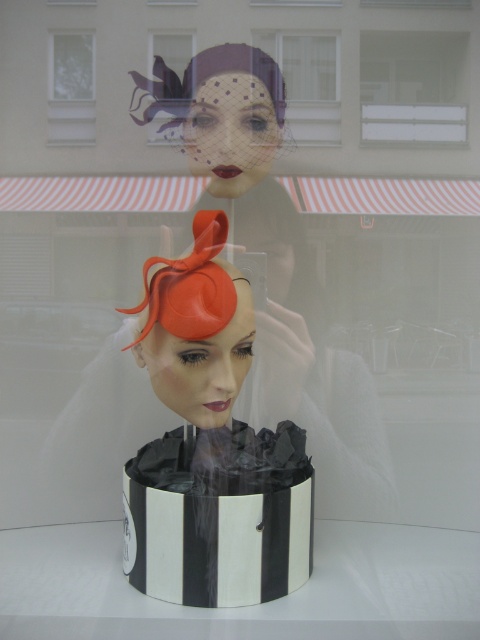
Based on the photo, is orange matte fascinator at center taller than transparent glass window at upper left?

Indeed, orange matte fascinator at center has a greater height compared to transparent glass window at upper left.

Is point (190, 385) positioned after point (84, 38)?

No, it is not.

Does point (205, 305) come closer to viewer compared to point (64, 83)?

Yes, it is in front of point (64, 83).

This screenshot has width=480, height=640. In order to click on orange matte fascinator at center in this screenshot , I will do `click(196, 326)`.

Does matte black hat at center have a greater height compared to transparent glass window at upper left?

Indeed, matte black hat at center has a greater height compared to transparent glass window at upper left.

The width and height of the screenshot is (480, 640). What do you see at coordinates (229, 115) in the screenshot?
I see `matte black hat at center` at bounding box center [229, 115].

Is point (233, 138) positioned before point (81, 58)?

That is True.

Find the location of a particular element. matte black hat at center is located at coordinates (229, 115).

In the scene shown: Is orange matte fascinator at center to the right of matte black hat at upper center from the viewer's perspective?

Yes, orange matte fascinator at center is to the right of matte black hat at upper center.

Is orange matte fascinator at center behind matte black hat at upper center?

That is False.

Does point (143, 349) come behind point (182, 44)?

No, (143, 349) is in front of (182, 44).

Locate an element on the screen. The width and height of the screenshot is (480, 640). orange matte fascinator at center is located at coordinates (196, 326).